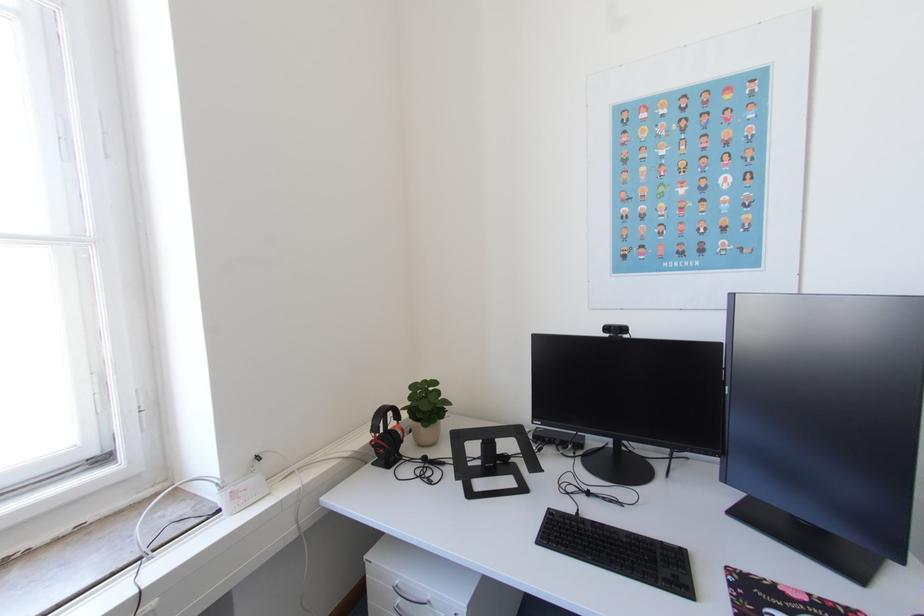
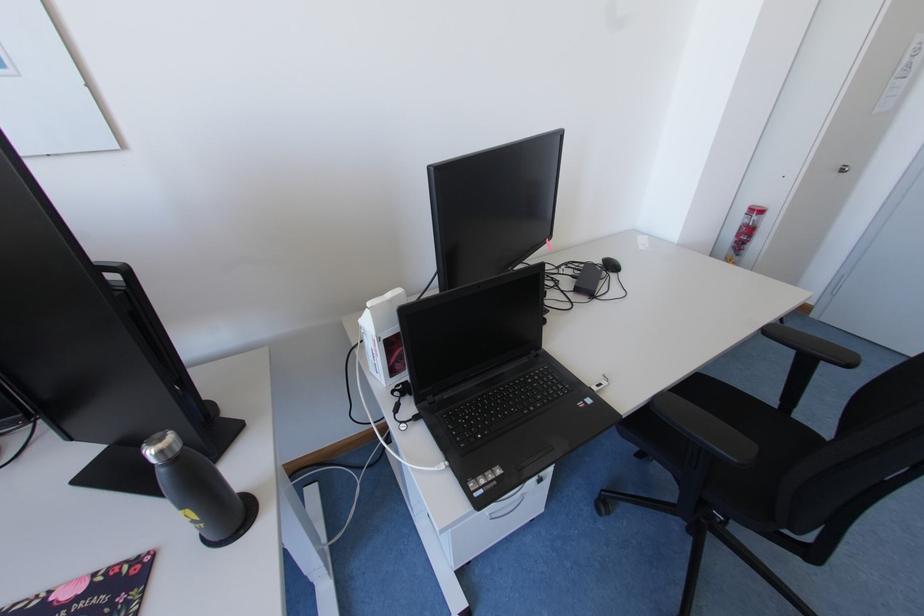
How did the camera likely rotate?

The camera's rotation is toward right-down.